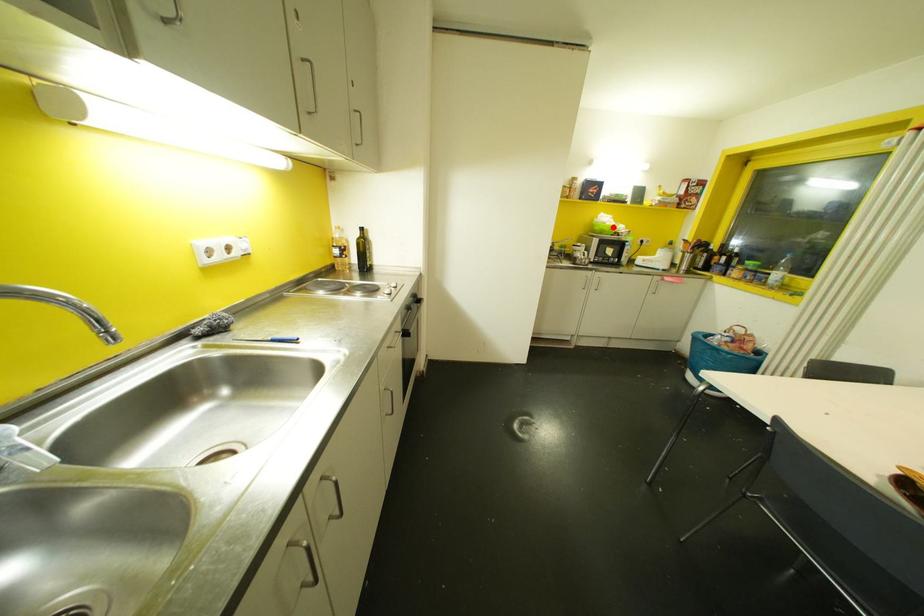
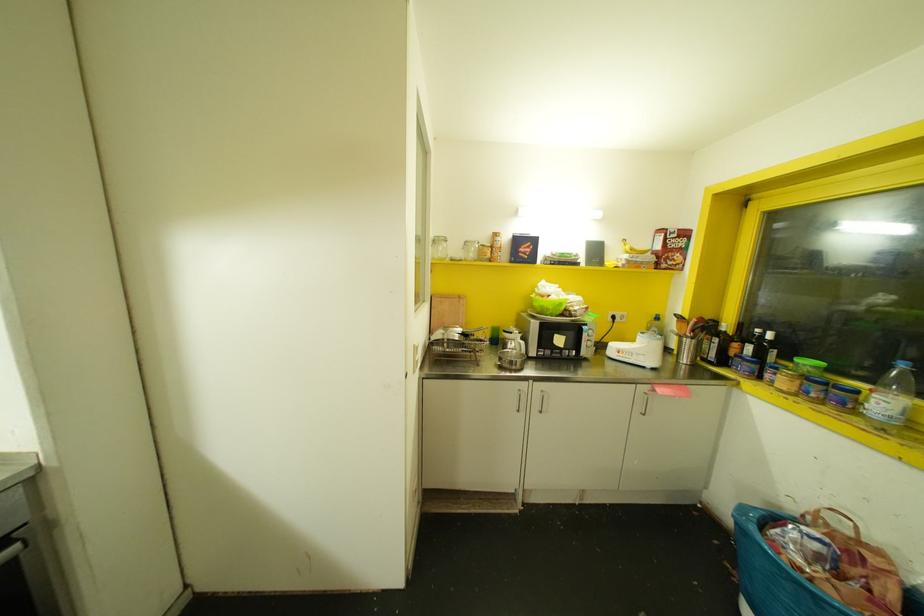
Find the pixel in the second image that matches the highlighted location in the first image.

(560, 304)